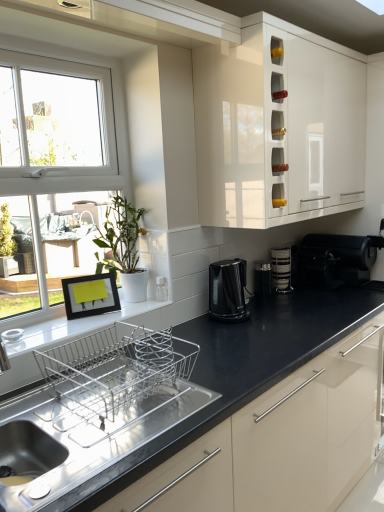
The width and height of the screenshot is (384, 512). What do you see at coordinates (278, 128) in the screenshot? I see `white glossy cabinet at upper center` at bounding box center [278, 128].

Describe the element at coordinates (102, 407) in the screenshot. The height and width of the screenshot is (512, 384). I see `stainless steel sink at lower left` at that location.

Find the location of a particular element. green leafy plant at left is located at coordinates (120, 237).

Find the location of a particular element. Image resolution: width=384 pixels, height=512 pixels. black plastic toaster at right, acting as the 1th appliance starting from the right is located at coordinates (333, 260).

In order to click on matte white coffee maker at upper center, which appears as the 3th appliance when viewed from the back in this screenshot , I will do `click(161, 289)`.

The width and height of the screenshot is (384, 512). What are the coordinates of `white glossy cabinet at upper center` in the screenshot? It's located at (278, 128).

The height and width of the screenshot is (512, 384). Find the location of `home appliance located below the matte white coffee maker at upper center, acting as the first appliance starting from the front (from the image's perspective)`. home appliance located below the matte white coffee maker at upper center, acting as the first appliance starting from the front (from the image's perspective) is located at coordinates (228, 290).

Is black glossy electric kettle at center far away from matte white coffee maker at upper center, the 3th appliance from the right?

black glossy electric kettle at center is near matte white coffee maker at upper center, the 3th appliance from the right, not far away.

Does black glossy electric kettle at center appear on the right side of matte white coffee maker at upper center, which appears as the 3th appliance when viewed from the back?

Yes, black glossy electric kettle at center is to the right of matte white coffee maker at upper center, which appears as the 3th appliance when viewed from the back.

Measure the distance between black glossy electric kettle at center and matte white coffee maker at upper center, which appears as the 3th appliance when viewed from the back.

black glossy electric kettle at center and matte white coffee maker at upper center, which appears as the 3th appliance when viewed from the back, are 10.70 inches apart.

Who is taller, white glossy cabinet at upper center or white glossy window sill at lower left?

With more height is white glossy cabinet at upper center.

Is white glossy cabinet at upper center surrounding white glossy window sill at lower left?

No, white glossy window sill at lower left is located outside of white glossy cabinet at upper center.

Who is bigger, white glossy cabinet at upper center or white glossy window sill at lower left?

white glossy cabinet at upper center.

Considering the positions of point (329, 57) and point (155, 322), is point (329, 57) closer or farther from the camera than point (155, 322)?

Point (329, 57) is positioned farther from the camera compared to point (155, 322).

Is point (138, 211) closer or farther from the camera than point (62, 336)?

Point (138, 211) appears to be farther away from the viewer than point (62, 336).

From a real-world perspective, is green leafy plant at left over white glossy window sill at lower left?

Yes, from a real-world perspective, green leafy plant at left is above white glossy window sill at lower left.

Which object is thinner, green leafy plant at left or white glossy window sill at lower left?

With smaller width is green leafy plant at left.

Could you tell me if matte white coffee maker at upper center, the 3th appliance from the right, is turned towards white glossy cabinet at upper center?

No.

Is matte white coffee maker at upper center, which is the first appliance in left-to-right order, bigger or smaller than white glossy cabinet at upper center?

Clearly, matte white coffee maker at upper center, which is the first appliance in left-to-right order, is smaller in size than white glossy cabinet at upper center.

Looking at this image, can you tell me how much matte white coffee maker at upper center, which appears as the 3th appliance when viewed from the back, and white glossy cabinet at upper center differ in facing direction?

matte white coffee maker at upper center, which appears as the 3th appliance when viewed from the back, and white glossy cabinet at upper center are facing 2.4 degrees away from each other.

Would you say matte white coffee maker at upper center, which is the first appliance in left-to-right order, is inside or outside white glossy cabinet at upper center?

matte white coffee maker at upper center, which is the first appliance in left-to-right order, is outside white glossy cabinet at upper center.

Is black plastic toaster at right, arranged as the 3th appliance when viewed from the left, placed right next to matte white coffee maker at upper center, the 3th appliance from the right?

No, black plastic toaster at right, arranged as the 3th appliance when viewed from the left, is not making contact with matte white coffee maker at upper center, the 3th appliance from the right.

Is black plastic toaster at right, acting as the 1th appliance starting from the right, positioned beyond the bounds of matte white coffee maker at upper center, the 3th appliance from the right?

Absolutely, black plastic toaster at right, acting as the 1th appliance starting from the right, is external to matte white coffee maker at upper center, the 3th appliance from the right.

Considering the sizes of objects black plastic toaster at right, acting as the 1th appliance starting from the right, and matte white coffee maker at upper center, which appears as the 3th appliance when viewed from the back, in the image provided, who is shorter, black plastic toaster at right, acting as the 1th appliance starting from the right, or matte white coffee maker at upper center, which appears as the 3th appliance when viewed from the back,?

With less height is matte white coffee maker at upper center, which appears as the 3th appliance when viewed from the back.

What's the angular difference between black plastic toaster at right, acting as the 1th appliance starting from the right, and matte white coffee maker at upper center, which is the first appliance in left-to-right order,'s facing directions?

1.66 degrees.

Could you tell me if stacked plates at center is facing black glossy electric kettle at center?

No, stacked plates at center is not facing towards black glossy electric kettle at center.

Is point (271, 265) closer to viewer compared to point (224, 261)?

That is False.

In terms of width, does stacked plates at center look wider or thinner when compared to black glossy electric kettle at center?

Clearly, stacked plates at center has less width compared to black glossy electric kettle at center.

Considering the positions of objects stacked plates at center and black glossy electric kettle at center in the image provided, who is more to the left, stacked plates at center or black glossy electric kettle at center?

From the viewer's perspective, black glossy electric kettle at center appears more on the left side.

Which object is thinner, black plastic toaster at right, acting as the 1th appliance starting from the right, or white glossy cabinet at upper center?

white glossy cabinet at upper center is thinner.

Consider the image. Which is more to the right, black plastic toaster at right, arranged as the 3th appliance when viewed from the left, or white glossy cabinet at upper center?

black plastic toaster at right, arranged as the 3th appliance when viewed from the left.

From a real-world perspective, which is physically below, black plastic toaster at right, arranged as the 3th appliance when viewed from the left, or white glossy cabinet at upper center?

From a 3D spatial view, black plastic toaster at right, arranged as the 3th appliance when viewed from the left, is below.

Considering the sizes of objects black plastic toaster at right, the 2th appliance when ordered from front to back, and white glossy cabinet at upper center in the image provided, who is taller, black plastic toaster at right, the 2th appliance when ordered from front to back, or white glossy cabinet at upper center?

white glossy cabinet at upper center is taller.

Where is `home appliance beneath the matte white coffee maker at upper center, which appears as the 3th appliance when viewed from the back (from a real-world perspective)`? The height and width of the screenshot is (512, 384). home appliance beneath the matte white coffee maker at upper center, which appears as the 3th appliance when viewed from the back (from a real-world perspective) is located at coordinates (228, 290).

Find the location of a particular element. window sill in front of the white glossy cabinet at upper center is located at coordinates (x=88, y=326).

When comparing their distances from matte white coffee maker at upper center, which is the first appliance in left-to-right order, does white glossy cabinet at upper center or stacked plates at center seem closer?

stacked plates at center.

Which object lies nearer to the anchor point white glossy cabinet at upper center, black plastic toaster at right, the 2th appliance when ordered from front to back, or black plastic toaster at center, which appears as the second appliance when viewed from the left?

black plastic toaster at right, the 2th appliance when ordered from front to back, lies closer to white glossy cabinet at upper center than the other object.

Which object lies nearer to the anchor point stacked plates at center, black plastic toaster at right, acting as the 1th appliance starting from the right, or black plastic toaster at center, which appears as the second appliance when viewed from the left?

black plastic toaster at center, which appears as the second appliance when viewed from the left, is closer to stacked plates at center.

From the image, which object appears to be nearer to stainless steel sink at lower left, black glossy electric kettle at center or black plastic toaster at center, which appears as the second appliance when viewed from the left?

black glossy electric kettle at center lies closer to stainless steel sink at lower left than the other object.

Considering their positions, is black plastic toaster at center, placed as the first appliance when sorted from back to front, positioned closer to white glossy window sill at lower left than green leafy plant at left?

green leafy plant at left lies closer to white glossy window sill at lower left than the other object.

Estimate the real-world distances between objects in this image. Which object is further from matte white coffee maker at upper center, the 3th appliance from the right, black glossy electric kettle at center or white glossy window sill at lower left?

white glossy window sill at lower left is further to matte white coffee maker at upper center, the 3th appliance from the right.

When comparing their distances from black plastic toaster at center, placed as the first appliance when sorted from back to front, does green leafy plant at left or white glossy cabinet at upper center seem closer?

white glossy cabinet at upper center is closer to black plastic toaster at center, placed as the first appliance when sorted from back to front.

When comparing their distances from white glossy window sill at lower left, does black plastic toaster at right, acting as the 1th appliance starting from the right, or stainless steel sink at lower left seem further?

black plastic toaster at right, acting as the 1th appliance starting from the right.

Identify the location of plant between white glossy window sill at lower left and stacked plates at center in the horizontal direction. Image resolution: width=384 pixels, height=512 pixels. (120, 237).

The width and height of the screenshot is (384, 512). In order to click on appliance between white glossy window sill at lower left and black glossy electric kettle at center from left to right in this screenshot , I will do `click(161, 289)`.

Locate an element on the screen. The width and height of the screenshot is (384, 512). appliance between white glossy cabinet at upper center and black plastic toaster at center, the third appliance in the front-to-back sequence, vertically is located at coordinates [333, 260].

Locate an element on the screen. This screenshot has width=384, height=512. home appliance situated between matte white coffee maker at upper center, the 3th appliance from the right, and black plastic toaster at right, the 2th appliance when ordered from front to back, from left to right is located at coordinates (228, 290).